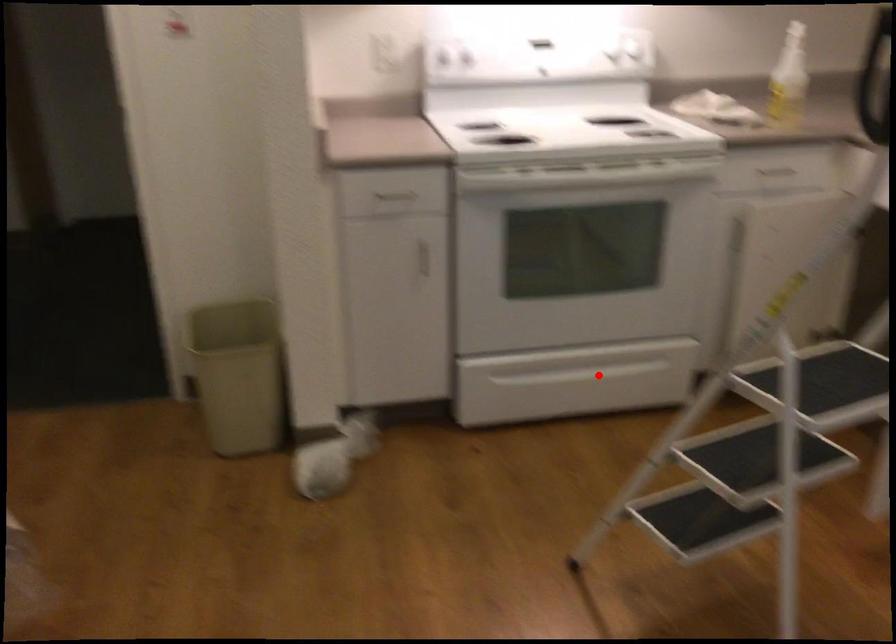
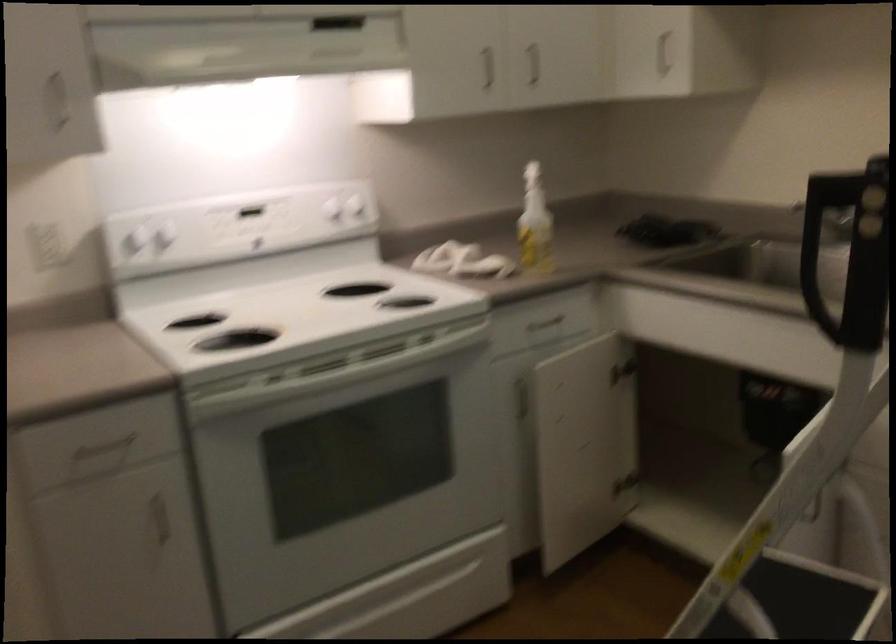
Question: I am providing you with two images of the same scene from different viewpoints. A red point is marked on the first image. At the location where the point appears in image 1, is it still visible in image 2?

Choices:
 (A) Yes
 (B) No

Answer: (A)